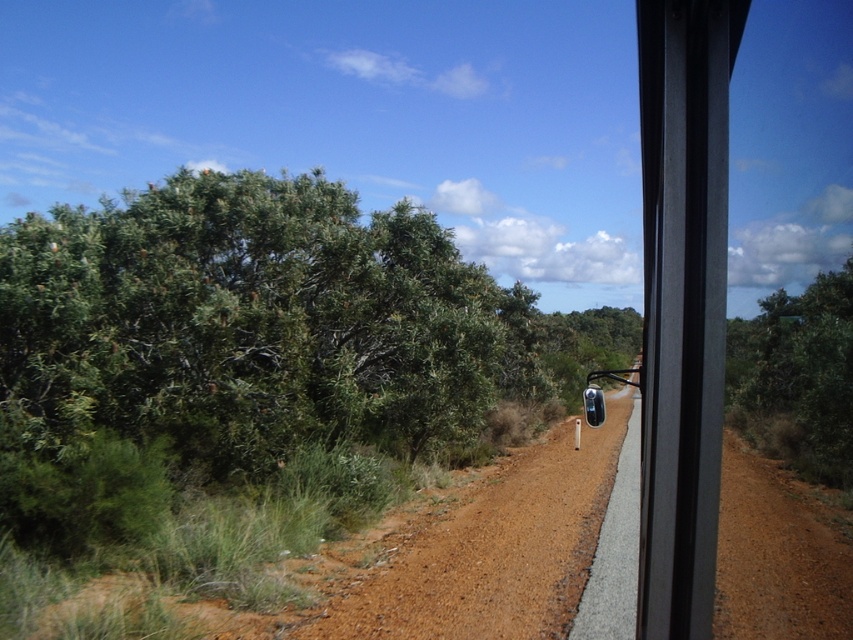
You are driving a car and see two points on the road ahead. The first point is at coordinates point (x=537, y=577) and the second is at point (x=820, y=461). Which point is closer to your car?

Point (x=537, y=577) is in front of point (x=820, y=461), so the first point is closer to your car.